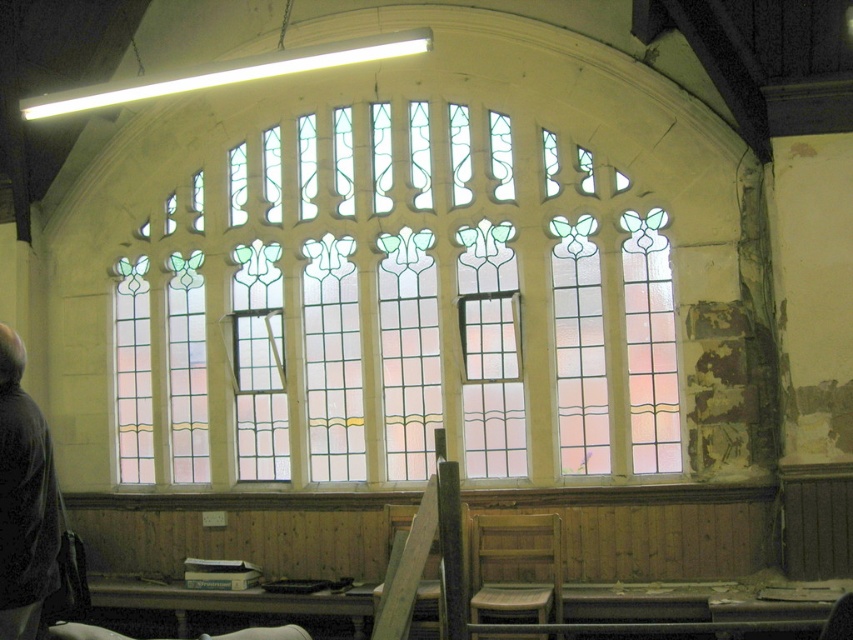
Locate an element on the screen. This screenshot has height=640, width=853. dark gray sweater at lower left is located at coordinates (24, 502).

Who is positioned more to the left, clear stained glass at center or dark gray sweater at lower left?

Positioned to the left is dark gray sweater at lower left.

Is clear stained glass at center thinner than dark gray sweater at lower left?

Incorrect, clear stained glass at center's width is not less than dark gray sweater at lower left's.

Between point (410, 150) and point (22, 470), which one is positioned behind?

The point (410, 150) is behind.

The image size is (853, 640). Identify the location of clear stained glass at center. (399, 308).

Can you confirm if clear stained glass at center is positioned above pink stained glass window at center?

Indeed, clear stained glass at center is positioned over pink stained glass window at center.

Where is `clear stained glass at center`? clear stained glass at center is located at coordinates (399, 308).

You are a GUI agent. You are given a task and a screenshot of the screen. Output one action in this format:
    pyautogui.click(x=<x>, y=<y>)
    Task: Click on the clear stained glass at center
    The image size is (853, 640).
    Given the screenshot: What is the action you would take?
    pyautogui.click(x=399, y=308)